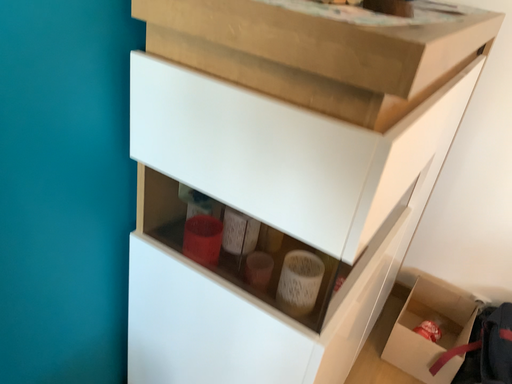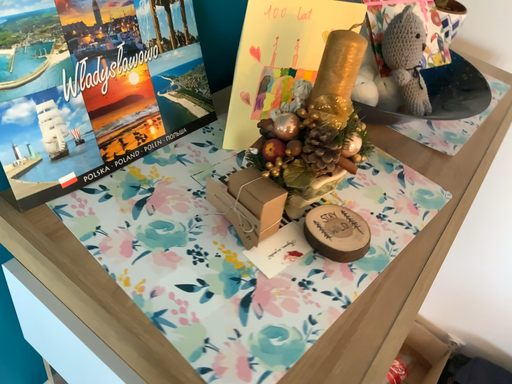
Question: Which way did the camera rotate in the video?

Choices:
 (A) rotated upward
 (B) rotated downward

Answer: (B)